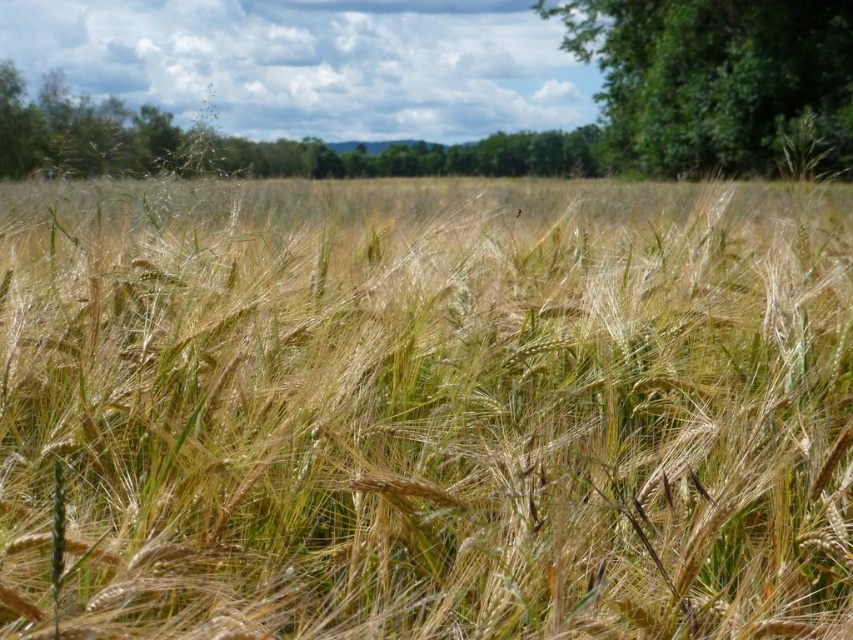
You are a farmer checking the growth of your crops. You notice the golden wheat field at center and the green leafy tree at upper right in your field. Which one is taller?

The green leafy tree at upper right is taller than the golden wheat field at center.

You are a farmer standing at the edge of a wheat field. You see a point marked at coordinates (x=425, y=408). What does this point indicate in the field?

The point at (x=425, y=408) marks the golden wheat field at center, indicating the central area of the field where the wheat is mature and ready for harvest.